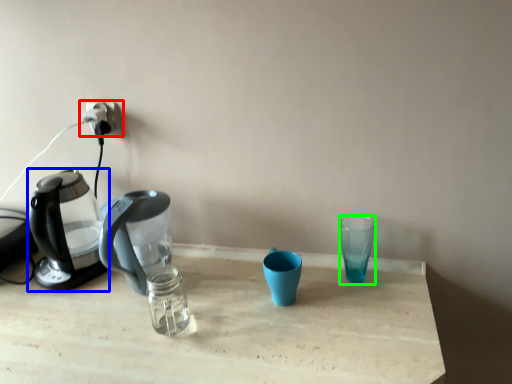
Question: Based on their relative distances, which object is nearer to power plugs and sockets (highlighted by a red box)? Choose from kettle (highlighted by a blue box) and coffee cup (highlighted by a green box).

Choices:
 (A) kettle
 (B) coffee cup

Answer: (A)